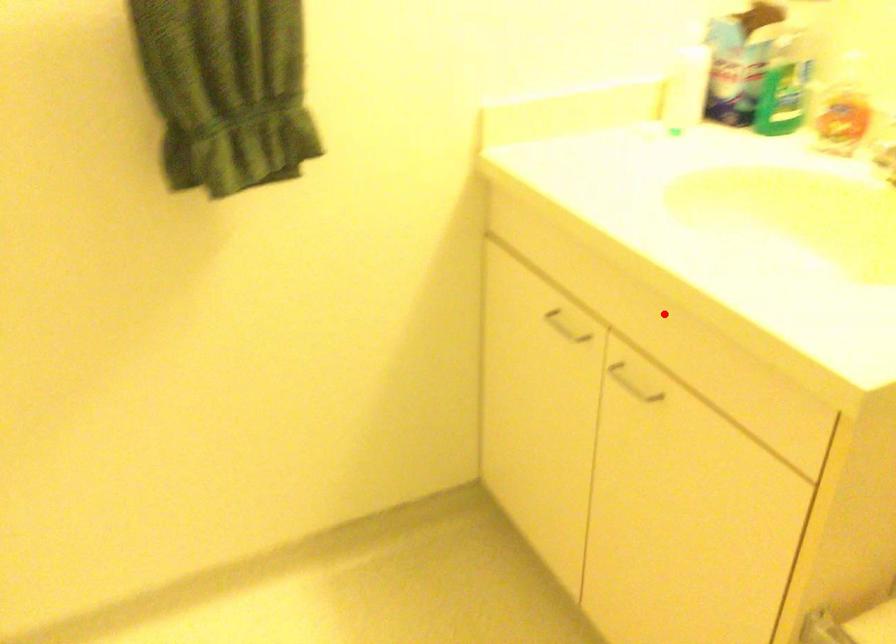
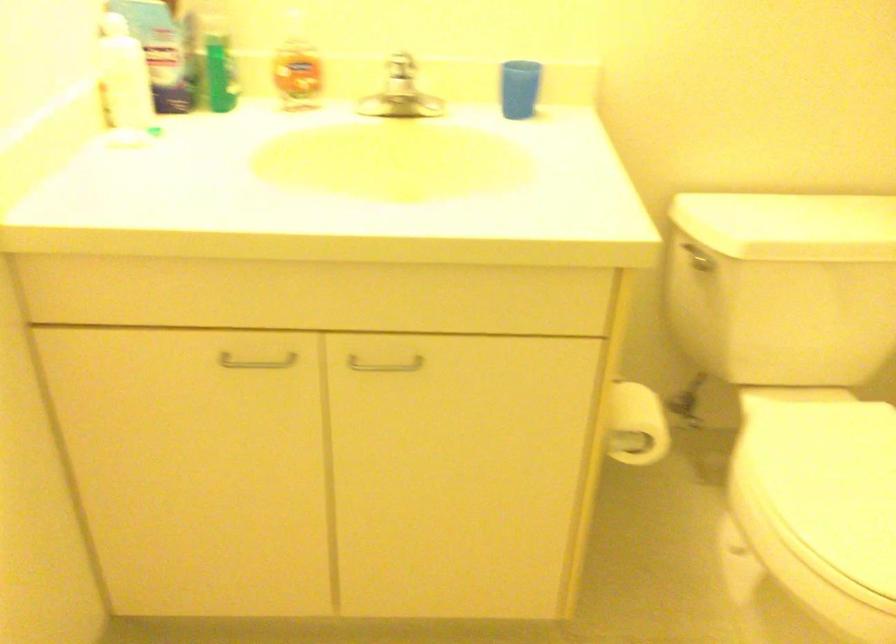
The point at the highlighted location is marked in the first image. Where is the corresponding point in the second image?

(400, 283)